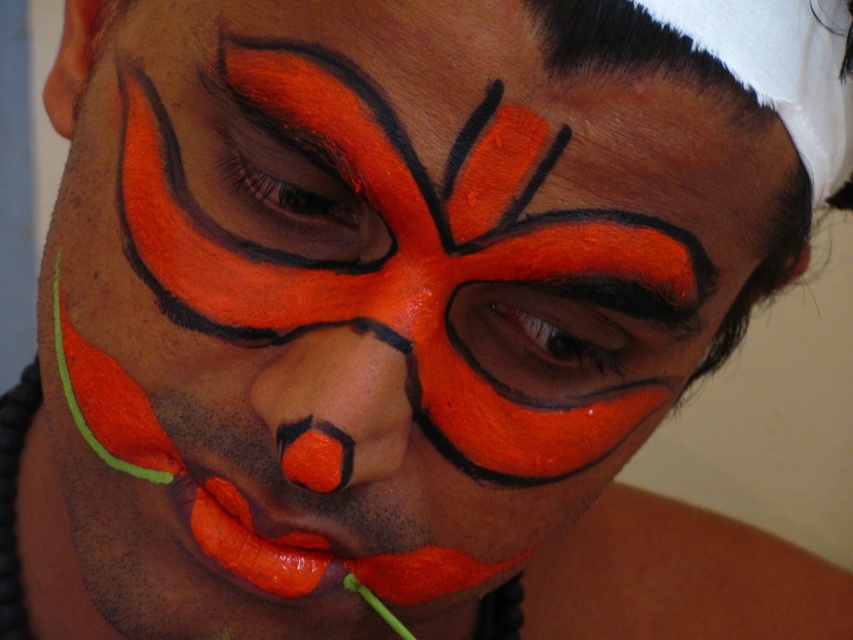
You are a makeup artist standing 12 inches away from a client. You need to apply a highlighter on the matte orange nose at center. Can you reach it without moving closer?

The matte orange nose at center is 14.33 inches away from the viewer. Since you are currently 12 inches away, you are already closer than the required distance, so you can easily apply the highlighter without needing to move closer.

You are a makeup artist preparing to apply face paint for a theatrical performance. You need to ensure that the matte orange nose at center and the matte orange lips at center are positioned correctly. Based on the image, which object is located higher on the face?

The matte orange nose at center is positioned above the matte orange lips at center, so the nose is higher on the face.

In the scene shown: You are a makeup artist standing 12 inches away from a client to apply their face paint. The client has a matte orange nose at center. Can you comfortably apply the design without needing to adjust your distance?

The matte orange nose at center is 14.33 inches away from the viewer. Since you are standing 12 inches away, you are closer than the required distance, so you may need to step back to ensure proper application.